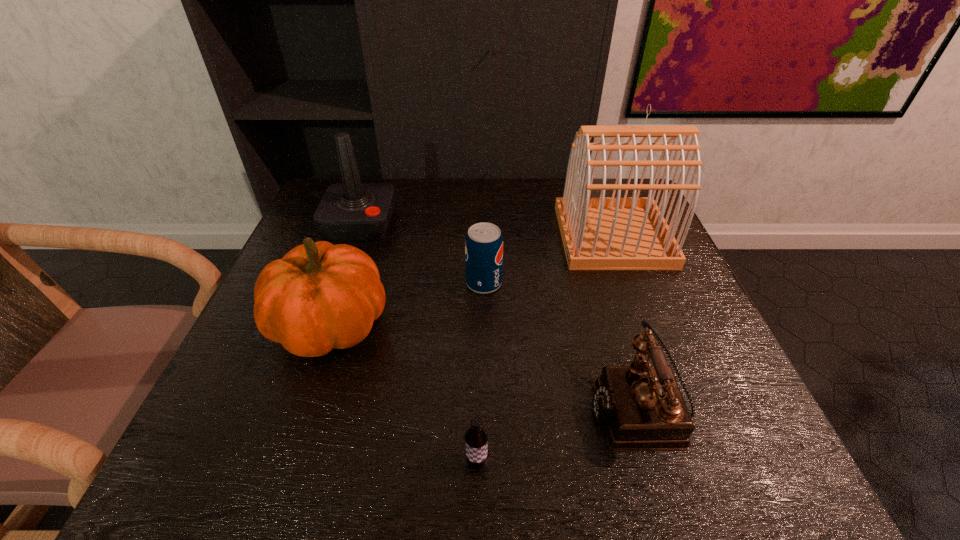
The height and width of the screenshot is (540, 960). Identify the location of the tallest object. (598, 233).

This screenshot has width=960, height=540. I want to click on joystick, so click(350, 211).

The image size is (960, 540). Find the location of `the fourth shortest object`. the fourth shortest object is located at coordinates (318, 297).

The image size is (960, 540). I want to click on telephone, so click(641, 407).

This screenshot has height=540, width=960. I want to click on pop, so 484,243.

Where is `root beer`? The image size is (960, 540). root beer is located at coordinates (476, 437).

The image size is (960, 540). I want to click on blank area located with an open door on the tallest object, so click(x=476, y=236).

At what (x,y) coordinates should I click in order to perform the action: click on blank space located with an open door on the tallest object. Please return your answer as a coordinate pair (x, y). The image size is (960, 540). Looking at the image, I should click on (421, 236).

Identify the location of vacant space located with an open door on the tallest object. The height and width of the screenshot is (540, 960). (418, 236).

Where is `vacant area situated on the back of the joystick`? The height and width of the screenshot is (540, 960). vacant area situated on the back of the joystick is located at coordinates (371, 196).